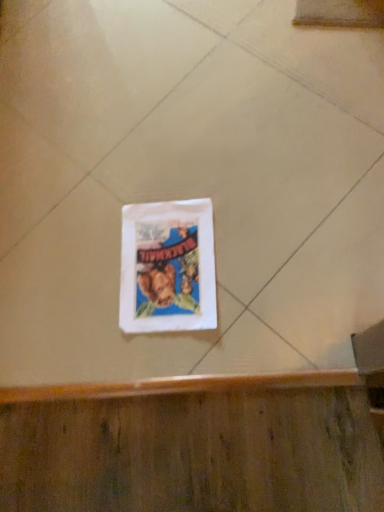
Question: Considering the relative sizes of white paper bag at center and white paper bag at center in the image provided, is white paper bag at center taller than white paper bag at center?

Choices:
 (A) no
 (B) yes

Answer: (B)

Question: Is white paper bag at center not within white paper bag at center?

Choices:
 (A) yes
 (B) no

Answer: (A)

Question: Would you say white paper bag at center contains white paper bag at center?

Choices:
 (A) no
 (B) yes

Answer: (B)

Question: Can you confirm if white paper bag at center is wider than white paper bag at center?

Choices:
 (A) yes
 (B) no

Answer: (A)

Question: Is white paper bag at center to the right of white paper bag at center from the viewer's perspective?

Choices:
 (A) no
 (B) yes

Answer: (B)

Question: Is white paper bag at center looking in the opposite direction of white paper bag at center?

Choices:
 (A) no
 (B) yes

Answer: (A)

Question: Is white paper bag at center far away from white paper bag at center?

Choices:
 (A) no
 (B) yes

Answer: (A)

Question: Does white paper bag at center have a greater height compared to white paper bag at center?

Choices:
 (A) no
 (B) yes

Answer: (A)

Question: Is white paper bag at center thinner than white paper bag at center?

Choices:
 (A) yes
 (B) no

Answer: (A)

Question: From a real-world perspective, does white paper bag at center sit lower than white paper bag at center?

Choices:
 (A) no
 (B) yes

Answer: (B)

Question: Does white paper bag at center lie in front of white paper bag at center?

Choices:
 (A) yes
 (B) no

Answer: (B)

Question: From the image's perspective, is white paper bag at center above white paper bag at center?

Choices:
 (A) yes
 (B) no

Answer: (B)

Question: In the image, is white paper bag at center positioned in front of or behind white paper bag at center?

Choices:
 (A) behind
 (B) front

Answer: (A)